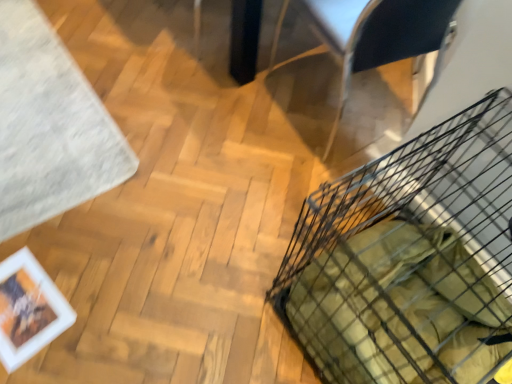
This screenshot has height=384, width=512. I want to click on free spot in front of metallic silver armchair at upper right, so click(273, 182).